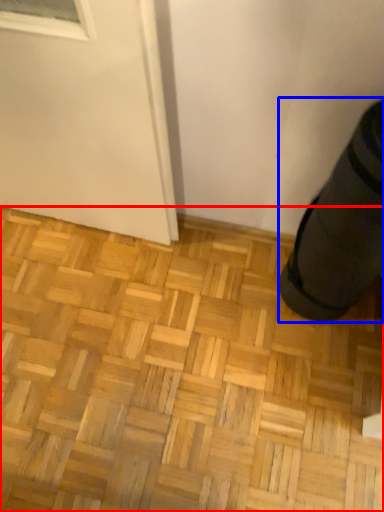
Question: Among these objects, which one is farthest to the camera, hardwood (highlighted by a red box) or shoe (highlighted by a blue box)?

Choices:
 (A) hardwood
 (B) shoe

Answer: (A)